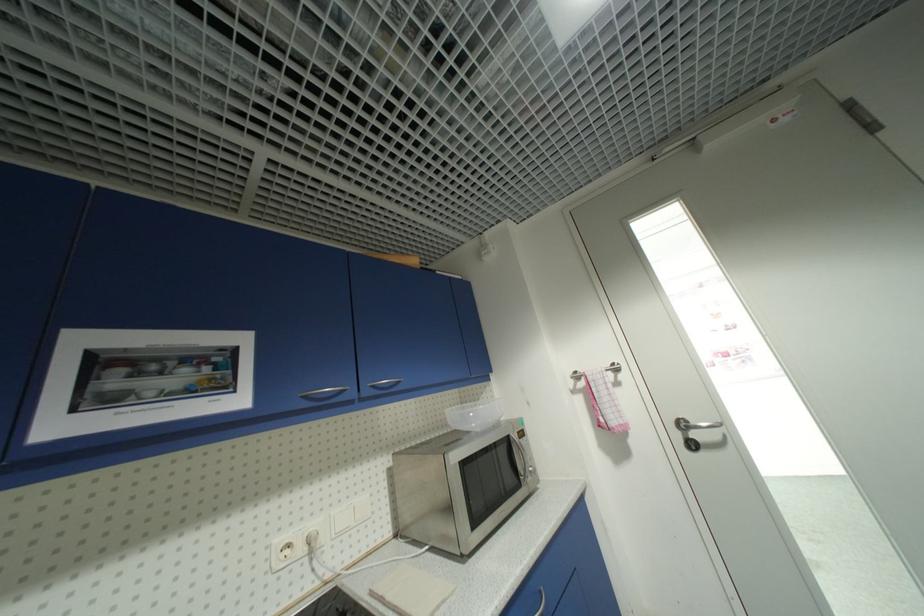
Where would you turn the silver door handle? Please return your answer as a coordinate pair (x, y).

(695, 424)